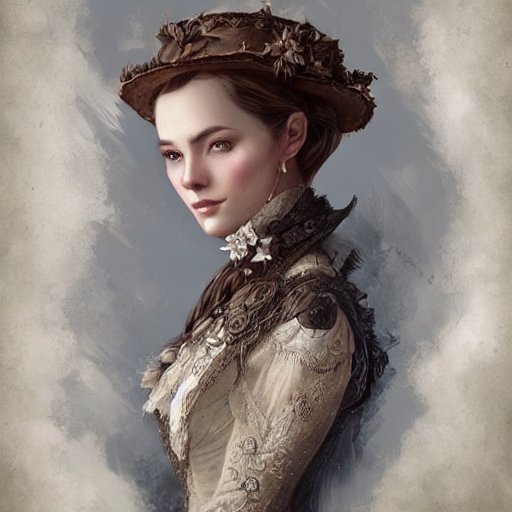
The width and height of the screenshot is (512, 512). In order to click on portrait in this screenshot , I will do `click(89, 232)`.